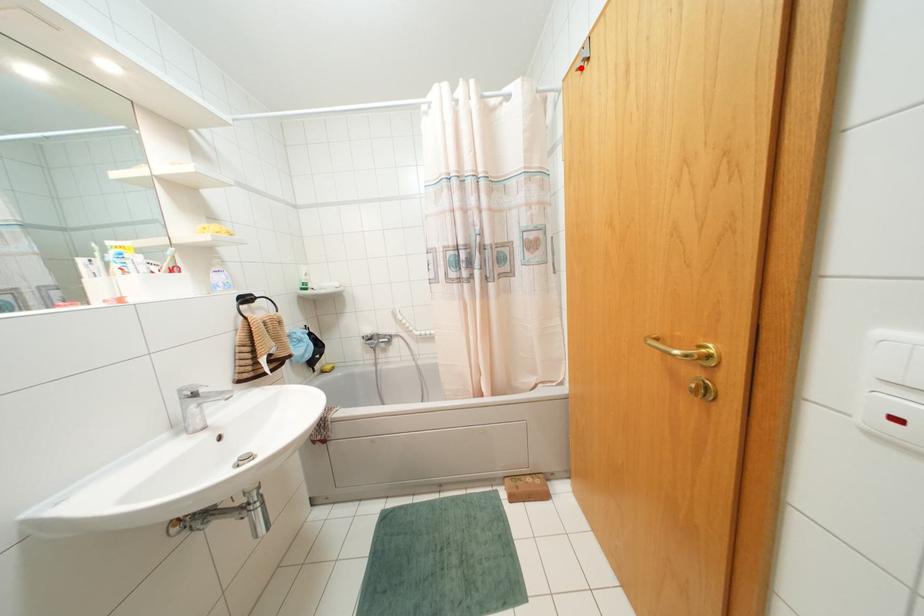
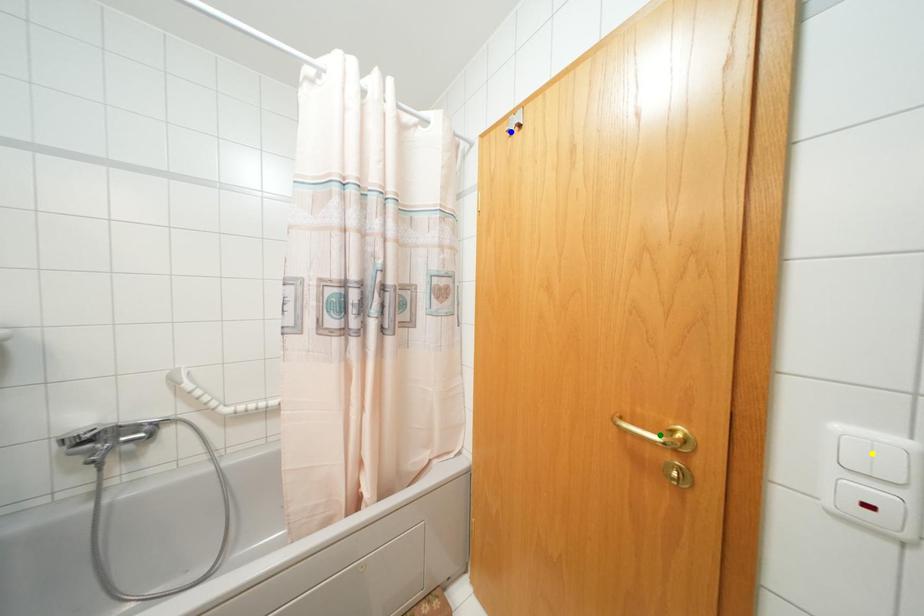
Question: I am providing you with two images of the same scene from different viewpoints. A red point is marked on the first image. You are given multiple points on the second image. Which mark in image 2 goes with the point in image 1?

Choices:
 (A) yellow point
 (B) blue point
 (C) green point

Answer: (B)